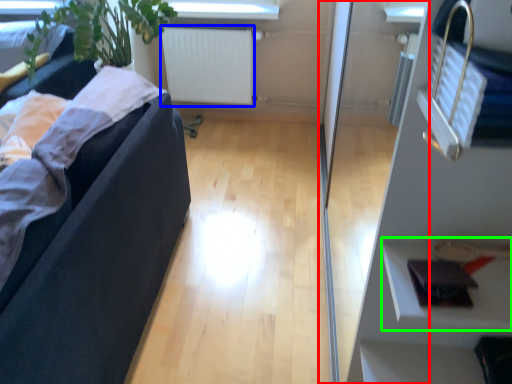
Question: Estimate the real-world distances between objects in this image. Which object is closer to glass door (highlighted by a red box), radiator (highlighted by a blue box) or shelf (highlighted by a green box)?

Choices:
 (A) radiator
 (B) shelf

Answer: (A)